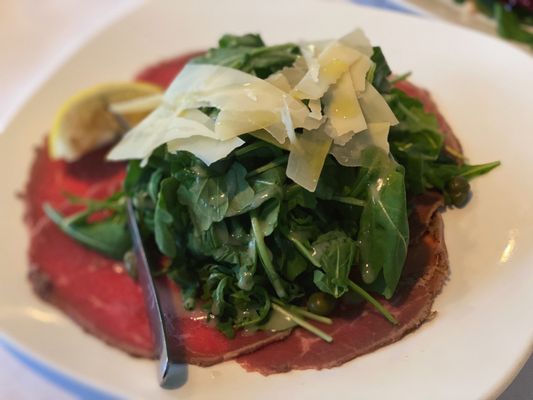
You are a GUI agent. You are given a task and a screenshot of the screen. Output one action in this format:
    pyautogui.click(x=<x>, y=<y>)
    Task: Click on the placemat
    
    Given the screenshot: What is the action you would take?
    pyautogui.click(x=385, y=3), pyautogui.click(x=20, y=381), pyautogui.click(x=520, y=390), pyautogui.click(x=30, y=30)